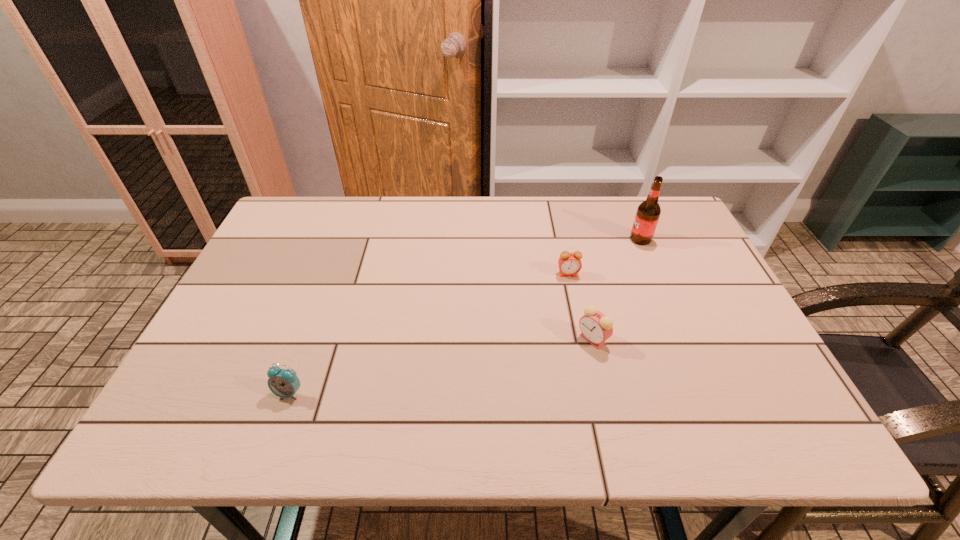
Where is `free spot located 0.340m on the face of the second farthest object`? The width and height of the screenshot is (960, 540). free spot located 0.340m on the face of the second farthest object is located at coordinates (592, 385).

The image size is (960, 540). I want to click on vacant area located on the face of the nearest object, so click(276, 428).

This screenshot has width=960, height=540. Find the location of `object that is at the far edge`. object that is at the far edge is located at coordinates (648, 212).

You are a GUI agent. You are given a task and a screenshot of the screen. Output one action in this format:
    pyautogui.click(x=<x>, y=<y>)
    Task: Click on the object situated at the right edge
    Image resolution: width=960 pixels, height=540 pixels.
    Given the screenshot: What is the action you would take?
    pyautogui.click(x=648, y=212)

Where is `object at the far right corner`? object at the far right corner is located at coordinates (648, 212).

In the image, there is a desktop. Find the location of `free space at the far edge`. free space at the far edge is located at coordinates (367, 212).

Locate an element on the screen. vacant space at the near edge of the desktop is located at coordinates (492, 422).

Image resolution: width=960 pixels, height=540 pixels. I want to click on vacant area at the left edge, so [293, 278].

Locate an element on the screen. The height and width of the screenshot is (540, 960). free location at the right edge is located at coordinates (688, 253).

This screenshot has width=960, height=540. In the image, there is a desktop. Find the location of `free space at the near right corner`. free space at the near right corner is located at coordinates (739, 410).